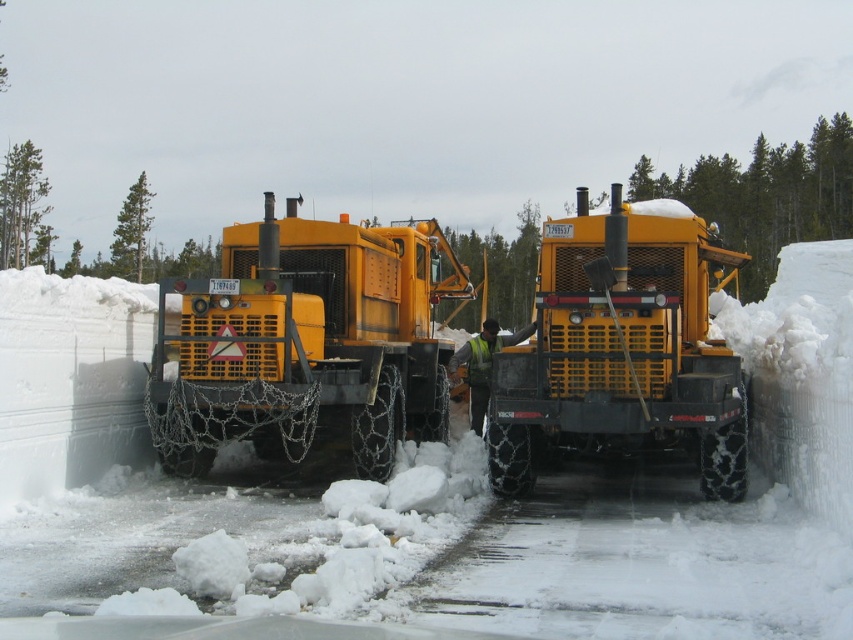
Question: Which object is positioned closest to the white fluffy snow at center?

Choices:
 (A) yellow matte truck at center
 (B) yellow rubber truck at center

Answer: (B)

Question: Is white fluffy snow at center further to camera compared to yellow rubber truck at center?

Choices:
 (A) no
 (B) yes

Answer: (A)

Question: Can you confirm if white fluffy snow at center is thinner than yellow rubber truck at center?

Choices:
 (A) no
 (B) yes

Answer: (A)

Question: From the image, what is the correct spatial relationship of white fluffy snow at center in relation to yellow matte truck at center?

Choices:
 (A) above
 (B) below

Answer: (A)

Question: Which point is farther from the camera taking this photo?

Choices:
 (A) (430, 250)
 (B) (250, 580)

Answer: (A)

Question: Estimate the real-world distances between objects in this image. Which object is farther from the yellow matte truck at center?

Choices:
 (A) white fluffy snow at center
 (B) yellow rubber truck at center

Answer: (A)